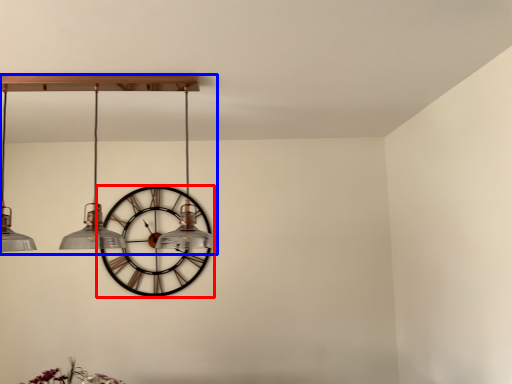
Question: Which object appears farthest to the camera in this image, wall clock (highlighted by a red box) or chandelier (highlighted by a blue box)?

Choices:
 (A) wall clock
 (B) chandelier

Answer: (A)